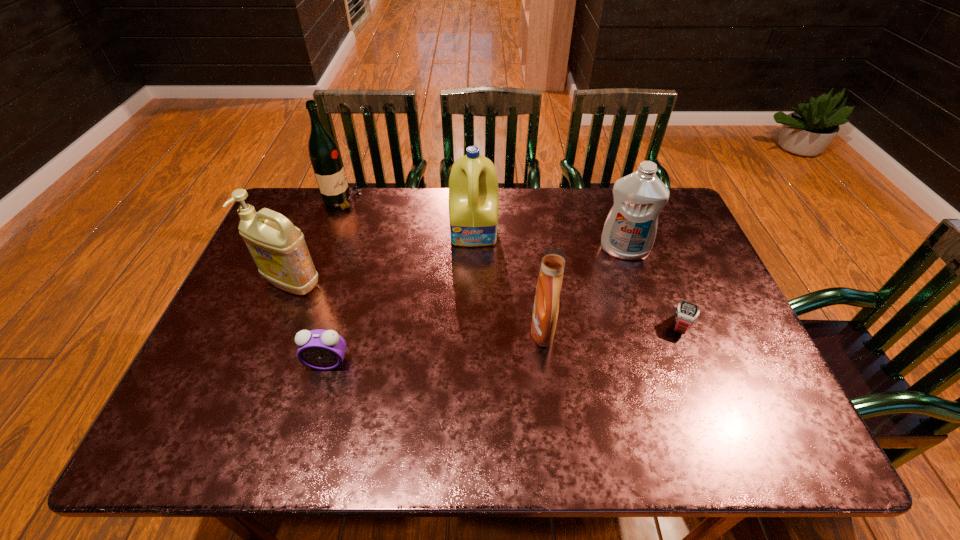
This screenshot has width=960, height=540. I want to click on free spot located 0.210m on the right of the farthest object, so click(424, 201).

The height and width of the screenshot is (540, 960). I want to click on vacant point located 0.390m on the left of the rightmost detergent, so (x=468, y=250).

At what (x,y) coordinates should I click in order to perform the action: click on vacant space located on the label of the fourth object from left to right. Please return your answer as a coordinate pair (x, y). The width and height of the screenshot is (960, 540). Looking at the image, I should click on (474, 274).

In order to click on vacant position located on the right of the third farthest detergent in this screenshot , I will do click(398, 283).

You are a GUI agent. You are given a task and a screenshot of the screen. Output one action in this format:
    pyautogui.click(x=<x>, y=<y>)
    Task: Click on the vacant space located on the front-facing side of the nearest detergent
    Image resolution: width=960 pixels, height=540 pixels.
    Given the screenshot: What is the action you would take?
    pyautogui.click(x=373, y=330)

The image size is (960, 540). What are the coordinates of `vacant region located 0.380m on the front-facing side of the nearest detergent` in the screenshot? It's located at (381, 330).

Find the location of a particular element. Image resolution: width=960 pixels, height=540 pixels. free spot located on the front-facing side of the nearest detergent is located at coordinates (389, 330).

The image size is (960, 540). In order to click on vacant area situated 0.050m on the face of the nearest object in this screenshot , I will do `click(320, 390)`.

The width and height of the screenshot is (960, 540). Find the location of `free spot located 0.120m on the back of the watch`. free spot located 0.120m on the back of the watch is located at coordinates (661, 280).

Locate an element on the screen. The height and width of the screenshot is (540, 960). wine bottle that is positioned at the far edge is located at coordinates (324, 154).